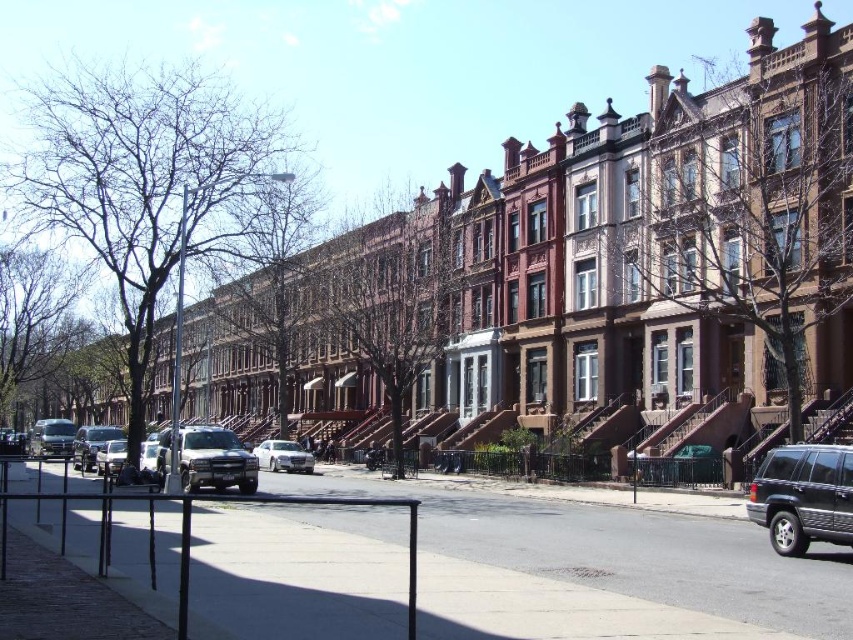
Is point (822, 525) closer to camera compared to point (38, 436)?

Yes.

The image size is (853, 640). Identify the location of black matte suv at lower right. (804, 497).

Does matte black suv at center have a greater height compared to silver metallic sedan at center?

Correct, matte black suv at center is much taller as silver metallic sedan at center.

Who is positioned more to the right, matte black suv at center or silver metallic sedan at center?

From the viewer's perspective, silver metallic sedan at center appears more on the right side.

Image resolution: width=853 pixels, height=640 pixels. I want to click on matte black suv at center, so click(51, 436).

Is point (775, 467) positioned before point (223, 477)?

Yes.

In the scene shown: Is black matte suv at lower right positioned behind matte silver suv at center?

No.

Which is behind, point (833, 467) or point (236, 445)?

Point (236, 445)

Locate an element on the screen. The image size is (853, 640). black matte suv at lower right is located at coordinates (804, 497).